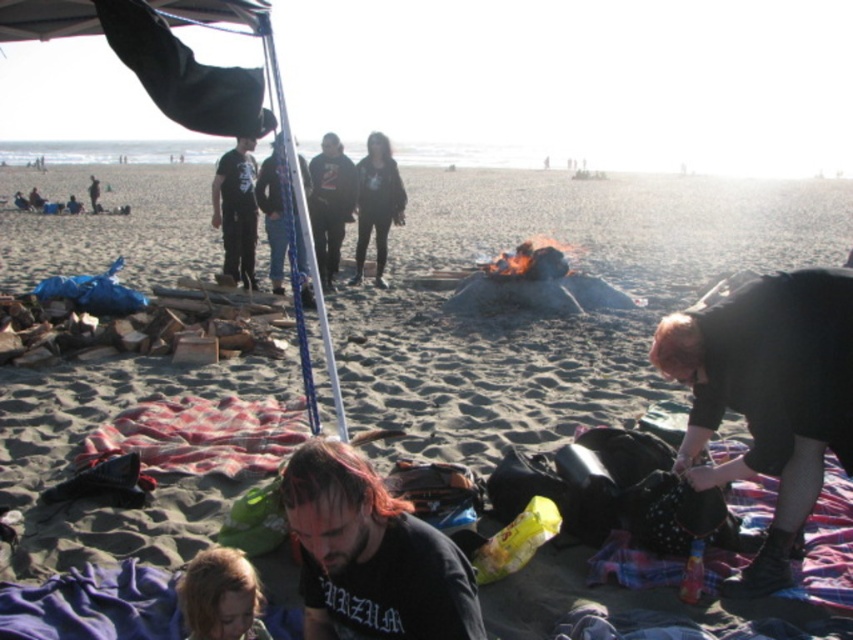
You are a photographer trying to capture a candid shot of the beach gathering. You want to ensure both the black matte jacket at lower right and the dark gray hoodie at center are visible in the frame. Based on their positions, which object should you focus on first to include both in the shot?

The black matte jacket at lower right is located below the dark gray hoodie at center, so focusing on the dark gray hoodie at center first will naturally include the black matte jacket at lower right in the frame below it.

You are a photographer at the beach scene. You want to take a photo that includes both the black matte jacket at lower right and the blonde hair at lower left. Which object should you focus on first to ensure both are in frame?

The black matte jacket at lower right is bigger than the blonde hair at lower left, so you should focus on the black matte jacket at lower right first to ensure both are in frame.